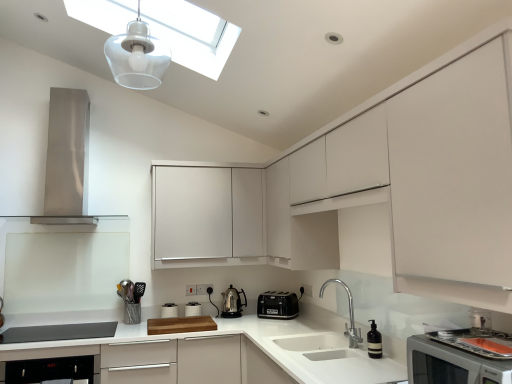
At what (x,y) coordinates should I click in order to perform the action: click on white matte cabinet at center, which is the second cabinetry in front-to-back order. Please return your answer as a coordinate pair (x, y). This screenshot has width=512, height=384. Looking at the image, I should click on (192, 213).

This screenshot has width=512, height=384. What do you see at coordinates (50, 364) in the screenshot? I see `black glossy dishwasher at lower left` at bounding box center [50, 364].

What do you see at coordinates (59, 162) in the screenshot? I see `stainless steel range hood at left, marked as the third home appliance in a bottom-to-top arrangement` at bounding box center [59, 162].

The width and height of the screenshot is (512, 384). Describe the element at coordinates (349, 314) in the screenshot. I see `polished stainless steel faucet at lower center` at that location.

Describe the element at coordinates (232, 303) in the screenshot. I see `polished stainless steel kettle at center, acting as the first kitchen appliance starting from the left` at that location.

The width and height of the screenshot is (512, 384). What do you see at coordinates (452, 364) in the screenshot?
I see `matte white microwave at lower right, which ranks as the second home appliance in top-to-bottom order` at bounding box center [452, 364].

At what (x,y) coordinates should I click in order to perform the action: click on translucent plastic light fixture at upper center. Please return your answer as a coordinate pair (x, y). Looking at the image, I should click on click(137, 56).

Is stainless steel range hood at left, which is the third home appliance from front to back, aimed at metallic silver utensil holder at lower left?

No, stainless steel range hood at left, which is the third home appliance from front to back, does not turn towards metallic silver utensil holder at lower left.

Considering the sizes of objects stainless steel range hood at left, the first home appliance in the back-to-front sequence, and metallic silver utensil holder at lower left in the image provided, who is taller, stainless steel range hood at left, the first home appliance in the back-to-front sequence, or metallic silver utensil holder at lower left?

Standing taller between the two is stainless steel range hood at left, the first home appliance in the back-to-front sequence.

Does point (85, 134) come closer to viewer compared to point (138, 284)?

That is True.

How many degrees apart are the facing directions of stainless steel range hood at left, the 1th home appliance in the top-to-bottom sequence, and metallic silver utensil holder at lower left?

0.222 degrees.

From the image's perspective, which is below, white matte cabinet at center, which is the second cabinetry in front-to-back order, or white matte cabinet at center, marked as the 1th cabinetry in a front-to-back arrangement?

white matte cabinet at center, which is the second cabinetry in front-to-back order, appears lower in the image.

Considering the relative positions of white matte cabinet at center, which appears as the first cabinetry when viewed from the back, and white matte cabinet at center, the 2th cabinetry when ordered from back to front, in the image provided, is white matte cabinet at center, which appears as the first cabinetry when viewed from the back, behind white matte cabinet at center, the 2th cabinetry when ordered from back to front,?

Yes, white matte cabinet at center, which appears as the first cabinetry when viewed from the back, is further from the viewer.

From a real-world perspective, is white matte cabinet at center, which is the second cabinetry in front-to-back order, physically above white matte cabinet at center, marked as the 1th cabinetry in a front-to-back arrangement?

No, from a real-world perspective, white matte cabinet at center, which is the second cabinetry in front-to-back order, is not over white matte cabinet at center, marked as the 1th cabinetry in a front-to-back arrangement

Is white matte cabinet at center, which is the second cabinetry in front-to-back order, looking in the opposite direction of white matte cabinet at center, the 2th cabinetry when ordered from back to front?

Yes, white matte cabinet at center, which is the second cabinetry in front-to-back order,'s orientation is away from white matte cabinet at center, the 2th cabinetry when ordered from back to front.

At what (x,y) coordinates should I click in order to perform the action: click on the 1st home appliance counting from the left side of the transparent glass skylight at upper center. Please return your answer as a coordinate pair (x, y). Looking at the image, I should click on (58, 332).

Is matte gray soundbar at lower left, which is the 3th home appliance from top to bottom, shorter than transparent glass skylight at upper center?

Yes, matte gray soundbar at lower left, which is the 3th home appliance from top to bottom, is shorter than transparent glass skylight at upper center.

From a real-world perspective, which object rests below the other?

In real-world perspective, matte gray soundbar at lower left, which is the 1th home appliance in bottom-to-top order, is lower.

Would you consider matte gray soundbar at lower left, placed as the 2th home appliance when sorted from right to left, to be distant from transparent glass skylight at upper center?

matte gray soundbar at lower left, placed as the 2th home appliance when sorted from right to left, is far away from transparent glass skylight at upper center.

Would you say polished stainless steel faucet at lower center is inside or outside white matte countertop at center?

polished stainless steel faucet at lower center cannot be found inside white matte countertop at center.

What's the angular difference between polished stainless steel faucet at lower center and white matte countertop at center's facing directions?

92.3 degrees separate the facing orientations of polished stainless steel faucet at lower center and white matte countertop at center.

Which is in front, point (352, 300) or point (287, 379)?

Point (287, 379)

From a real-world perspective, which is physically below, polished stainless steel faucet at lower center or white matte countertop at center?

In real-world perspective, white matte countertop at center is lower.

From a real-world perspective, relative to white matte cabinet at center, which appears as the first cabinetry when viewed from the back, is translucent plastic light fixture at upper center vertically above or below?

From a real-world perspective, translucent plastic light fixture at upper center is physically above white matte cabinet at center, which appears as the first cabinetry when viewed from the back.

Is translucent plastic light fixture at upper center bigger than white matte cabinet at center, which appears as the first cabinetry when viewed from the back?

No.

Would you say translucent plastic light fixture at upper center is a long distance from white matte cabinet at center, which appears as the first cabinetry when viewed from the back?

Actually, translucent plastic light fixture at upper center and white matte cabinet at center, which appears as the first cabinetry when viewed from the back, are a little close together.

Is white matte cabinet at center, which appears as the first cabinetry when viewed from the back, inside translucent plastic light fixture at upper center?

No, white matte cabinet at center, which appears as the first cabinetry when viewed from the back, is located outside of translucent plastic light fixture at upper center.

Is white matte cabinet at center, which is the second cabinetry in front-to-back order, closer to the viewer compared to transparent glass skylight at upper center?

No, white matte cabinet at center, which is the second cabinetry in front-to-back order, is behind transparent glass skylight at upper center.

Can you tell me how much white matte cabinet at center, which is the second cabinetry in front-to-back order, and transparent glass skylight at upper center differ in facing direction?

The angle between the facing direction of white matte cabinet at center, which is the second cabinetry in front-to-back order, and the facing direction of transparent glass skylight at upper center is 89.1 degrees.

Considering the sizes of objects white matte cabinet at center, which appears as the first cabinetry when viewed from the back, and transparent glass skylight at upper center in the image provided, who is bigger, white matte cabinet at center, which appears as the first cabinetry when viewed from the back, or transparent glass skylight at upper center?

white matte cabinet at center, which appears as the first cabinetry when viewed from the back, is bigger.

From the image's perspective, which one is positioned lower, white matte cabinet at center, which is the second cabinetry in front-to-back order, or transparent glass skylight at upper center?

white matte cabinet at center, which is the second cabinetry in front-to-back order, from the image's perspective.

From the image's perspective, which one is positioned lower, polished stainless steel kettle at center, acting as the first kitchen appliance starting from the left, or black glossy dishwasher at lower left?

black glossy dishwasher at lower left is shown below in the image.

From a real-world perspective, does polished stainless steel kettle at center, marked as the 2th kitchen appliance in a right-to-left arrangement, stand above black glossy dishwasher at lower left?

Yes, from a real-world perspective, polished stainless steel kettle at center, marked as the 2th kitchen appliance in a right-to-left arrangement, is above black glossy dishwasher at lower left.

Does polished stainless steel kettle at center, acting as the first kitchen appliance starting from the left, have a greater height compared to black glossy dishwasher at lower left?

In fact, polished stainless steel kettle at center, acting as the first kitchen appliance starting from the left, may be shorter than black glossy dishwasher at lower left.

Between point (239, 298) and point (85, 372), which one is positioned behind?

Positioned behind is point (239, 298).

Locate an element on the screen. Image resolution: width=512 pixels, height=384 pixels. appliance behind the stainless steel range hood at left, acting as the 1th home appliance starting from the left is located at coordinates pyautogui.click(x=131, y=300).

The width and height of the screenshot is (512, 384). I want to click on cabinetry on the left of white matte cabinet at center, the 2th cabinetry when ordered from back to front, so click(192, 213).

Looking at the image, which one is located further to polished stainless steel kettle at center, marked as the 2th kitchen appliance in a right-to-left arrangement, matte white microwave at lower right, which ranks as the second home appliance in top-to-bottom order, or metallic silver utensil holder at lower left?

matte white microwave at lower right, which ranks as the second home appliance in top-to-bottom order, lies further to polished stainless steel kettle at center, marked as the 2th kitchen appliance in a right-to-left arrangement, than the other object.

Estimate the real-world distances between objects in this image. Which object is further from matte white microwave at lower right, which is counted as the 1th home appliance, starting from the right, metallic silver utensil holder at lower left or white matte countertop at center?

The object further to matte white microwave at lower right, which is counted as the 1th home appliance, starting from the right, is metallic silver utensil holder at lower left.

Which object lies further to the anchor point translucent plastic light fixture at upper center, transparent glass skylight at upper center or matte gray soundbar at lower left, placed as the 2th home appliance when sorted from right to left?

matte gray soundbar at lower left, placed as the 2th home appliance when sorted from right to left, is positioned further to the anchor translucent plastic light fixture at upper center.

Considering their positions, is polished stainless steel faucet at lower center positioned further to polished stainless steel kettle at center, acting as the first kitchen appliance starting from the left, than transparent glass skylight at upper center?

transparent glass skylight at upper center lies further to polished stainless steel kettle at center, acting as the first kitchen appliance starting from the left, than the other object.

From the picture: Based on their spatial positions, is matte gray soundbar at lower left, which is the 1th home appliance in bottom-to-top order, or stainless steel range hood at left, the 1th home appliance in the top-to-bottom sequence, closer to metallic silver utensil holder at lower left?

Among the two, matte gray soundbar at lower left, which is the 1th home appliance in bottom-to-top order, is located nearer to metallic silver utensil holder at lower left.

Looking at the image, which one is located closer to white matte countertop at center, translucent plastic light fixture at upper center or polished stainless steel faucet at lower center?

Among the two, polished stainless steel faucet at lower center is located nearer to white matte countertop at center.

Looking at the image, which one is located closer to transparent glass skylight at upper center, black glossy dishwasher at lower left or matte gray soundbar at lower left, which is the 1th home appliance in bottom-to-top order?

Among the two, black glossy dishwasher at lower left is located nearer to transparent glass skylight at upper center.

Looking at the image, which one is located further to matte gray soundbar at lower left, which is the 3th home appliance from top to bottom, black plastic toaster at lower center, the 1th kitchen appliance from the right, or polished stainless steel kettle at center, marked as the 2th kitchen appliance in a right-to-left arrangement?

black plastic toaster at lower center, the 1th kitchen appliance from the right, is further to matte gray soundbar at lower left, which is the 3th home appliance from top to bottom.

Locate an element on the screen. The width and height of the screenshot is (512, 384). appliance between transparent glass skylight at upper center and white matte countertop at center from top to bottom is located at coordinates (131, 300).

Locate an element on the screen. The image size is (512, 384). appliance between white matte countertop at center and black plastic toaster at lower center, the 1th kitchen appliance from the right, from left to right is located at coordinates (131, 300).

I want to click on appliance between matte white microwave at lower right, which is the 3th home appliance in back-to-front order, and black plastic toaster at lower center, which appears as the second kitchen appliance when viewed from the left, from front to back, so click(131, 300).

Locate an element on the screen. Image resolution: width=512 pixels, height=384 pixels. appliance between stainless steel range hood at left, which is the third home appliance from front to back, and polished stainless steel kettle at center, acting as the first kitchen appliance starting from the left, vertically is located at coordinates (131, 300).